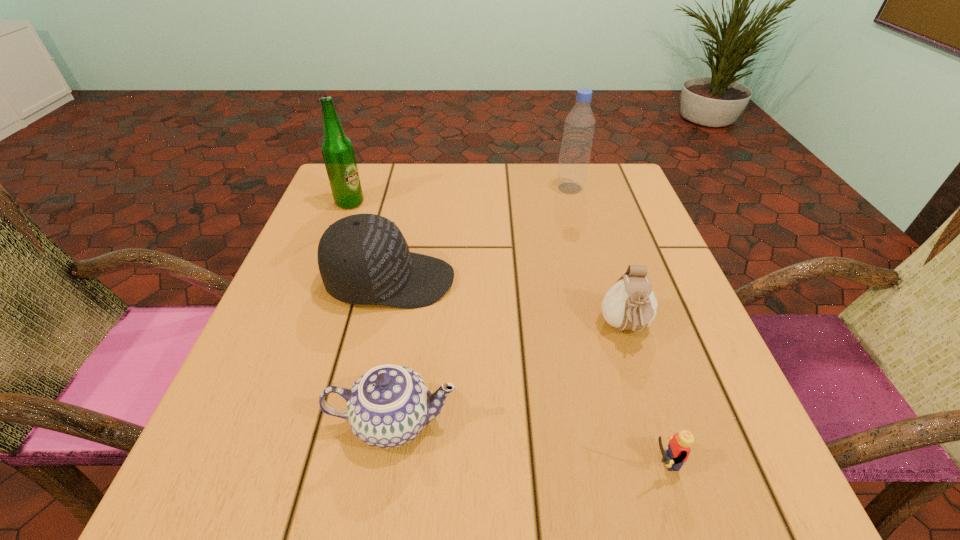
Identify the location of vacant space at the far left corner of the desktop. The width and height of the screenshot is (960, 540). (331, 197).

In the image, there is a desktop. Where is `vacant space at the far right corner`? vacant space at the far right corner is located at coordinates (607, 180).

You are a GUI agent. You are given a task and a screenshot of the screen. Output one action in this format:
    pyautogui.click(x=<x>, y=<y>)
    Task: Click on the free point between the Lego and the chinaware
    
    Given the screenshot: What is the action you would take?
    pyautogui.click(x=525, y=442)

Identify the location of free space that is in between the beer bottle and the bottle. (460, 195).

At what (x,y) coordinates should I click in order to perform the action: click on free space between the baseball cap and the chinaware. Please return your answer as a coordinate pair (x, y). The image size is (960, 540). Looking at the image, I should click on (392, 351).

Find the location of a particular element. vacant area that lies between the beer bottle and the pouch is located at coordinates (488, 266).

Identify the location of free spot between the pouch and the chinaware. (510, 375).

Where is `vacant space that's between the beer bottle and the bottle`? Image resolution: width=960 pixels, height=540 pixels. vacant space that's between the beer bottle and the bottle is located at coordinates (460, 195).

You are a GUI agent. You are given a task and a screenshot of the screen. Output one action in this format:
    pyautogui.click(x=<x>, y=<y>)
    Task: Click on the empty space that is in between the beer bottle and the Lego
    This screenshot has height=540, width=960.
    Given the screenshot: What is the action you would take?
    pyautogui.click(x=503, y=333)

Identify the location of blank region between the bottle and the chinaware. (x=482, y=305).